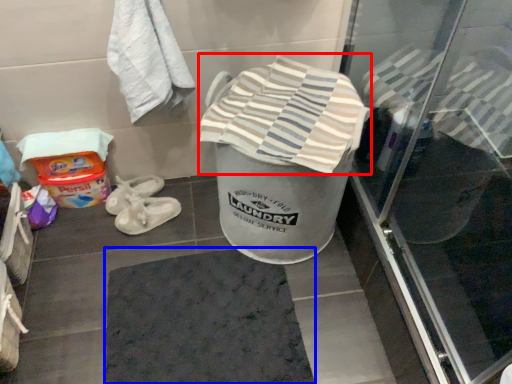
Question: Among these objects, which one is farthest to the camera, beach towel (highlighted by a red box) or bath mat (highlighted by a blue box)?

Choices:
 (A) beach towel
 (B) bath mat

Answer: (B)